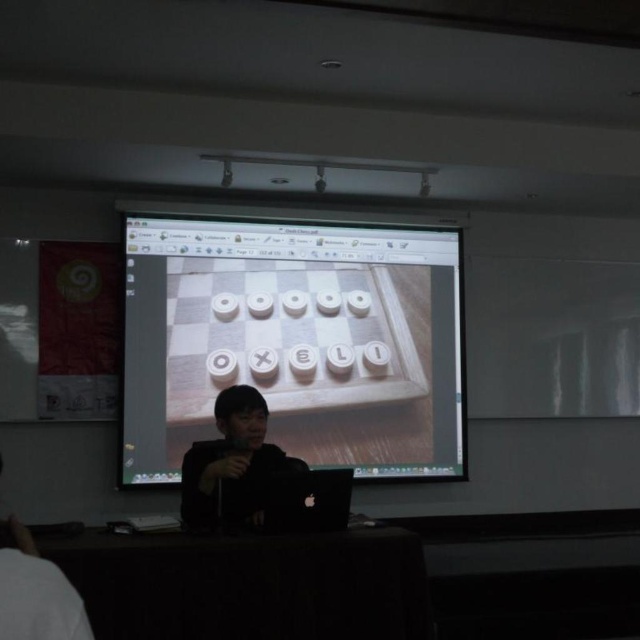
Question: Does wooden board at center appear over black matte shirt at center?

Choices:
 (A) no
 (B) yes

Answer: (B)

Question: Can you confirm if wooden board at center is positioned to the left of black matte shirt at center?

Choices:
 (A) yes
 (B) no

Answer: (B)

Question: Which of the following is the closest to the observer?

Choices:
 (A) (257, 502)
 (B) (136, 269)

Answer: (A)

Question: Is wooden board at center wider than black matte shirt at center?

Choices:
 (A) no
 (B) yes

Answer: (B)